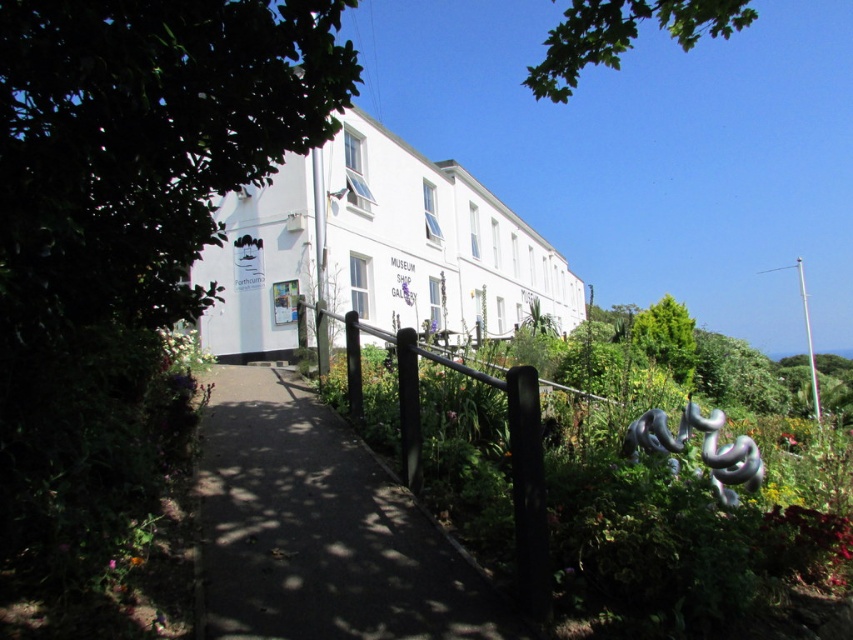
Question: In this image, where is metallic sculpture at center-right located relative to dark gray asphalt at center?

Choices:
 (A) right
 (B) left

Answer: (A)

Question: Does metallic sculpture at center-right have a greater width compared to dark gray asphalt at center?

Choices:
 (A) yes
 (B) no

Answer: (A)

Question: Among these points, which one is nearest to the camera?

Choices:
 (A) (751, 548)
 (B) (344, 547)

Answer: (A)

Question: Does metallic sculpture at center-right appear over dark gray asphalt at center?

Choices:
 (A) no
 (B) yes

Answer: (B)